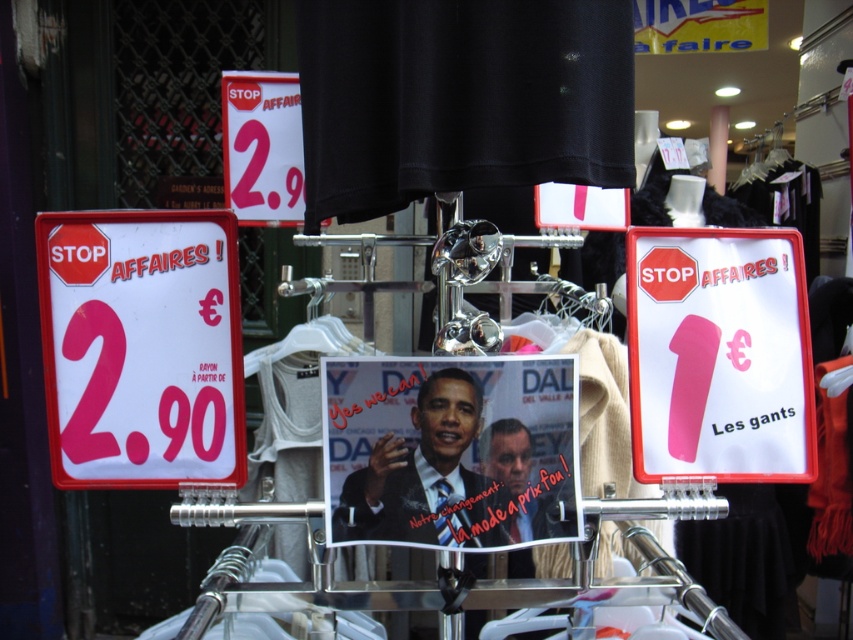
Question: Is pink paper sign at center wider than matte white sign at upper center?

Choices:
 (A) no
 (B) yes

Answer: (B)

Question: Which point is farther to the camera?

Choices:
 (A) matte white sign at upper center
 (B) white paper sign at left
 (C) smooth glossy poster at center

Answer: (A)

Question: Is smooth glossy poster at center thinner than matte white sign at upper center?

Choices:
 (A) no
 (B) yes

Answer: (A)

Question: Is white paper sign at left to the right of smooth glossy poster at center from the viewer's perspective?

Choices:
 (A) no
 (B) yes

Answer: (A)

Question: Which point is closer to the camera?

Choices:
 (A) matte white sign at upper center
 (B) pink paper sign at center
 (C) smooth glossy poster at center
 (D) white paper sign at left

Answer: (C)

Question: Which object appears farthest from the camera in this image?

Choices:
 (A) white paper sign at left
 (B) pink paper sign at center
 (C) matte white sign at upper center

Answer: (C)